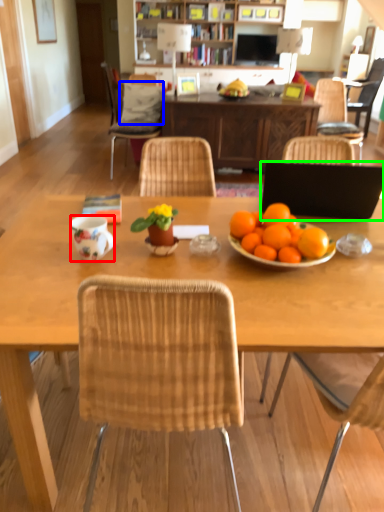
Question: Based on their relative distances, which object is farther from coffee cup (highlighted by a red box)? Choose from pillow (highlighted by a blue box) and laptop (highlighted by a green box).

Choices:
 (A) pillow
 (B) laptop

Answer: (A)